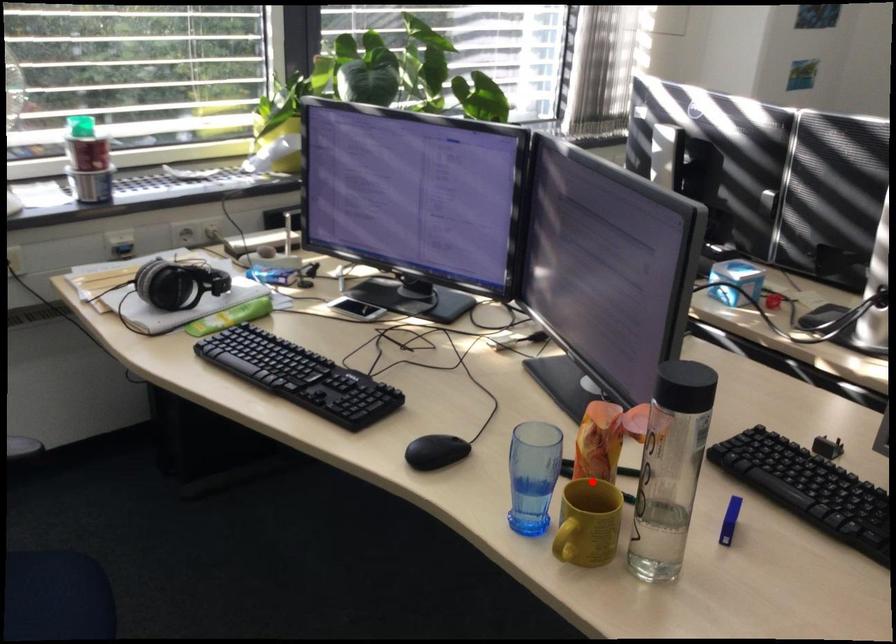
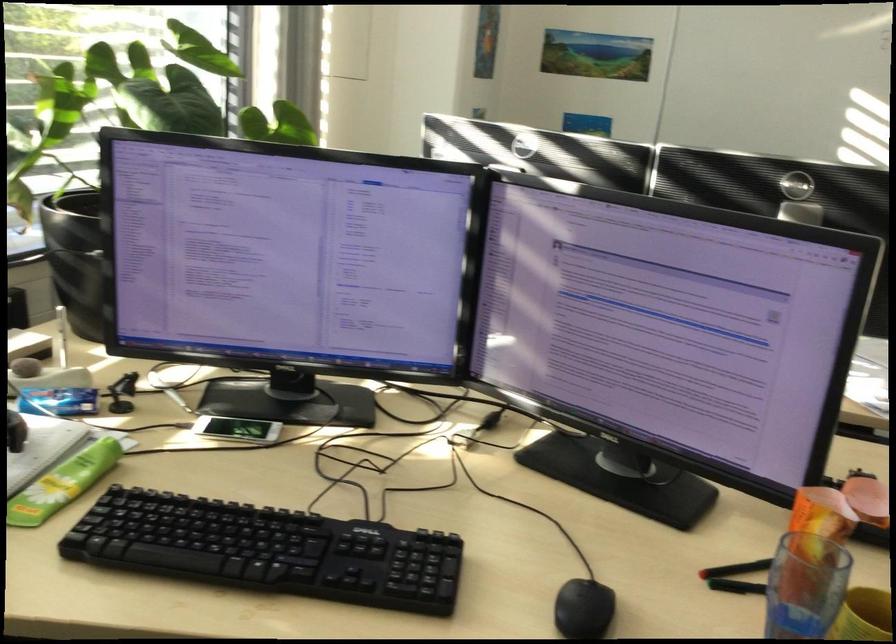
Find the pixel in the second image that matches the highlighted location in the first image.

(805, 585)